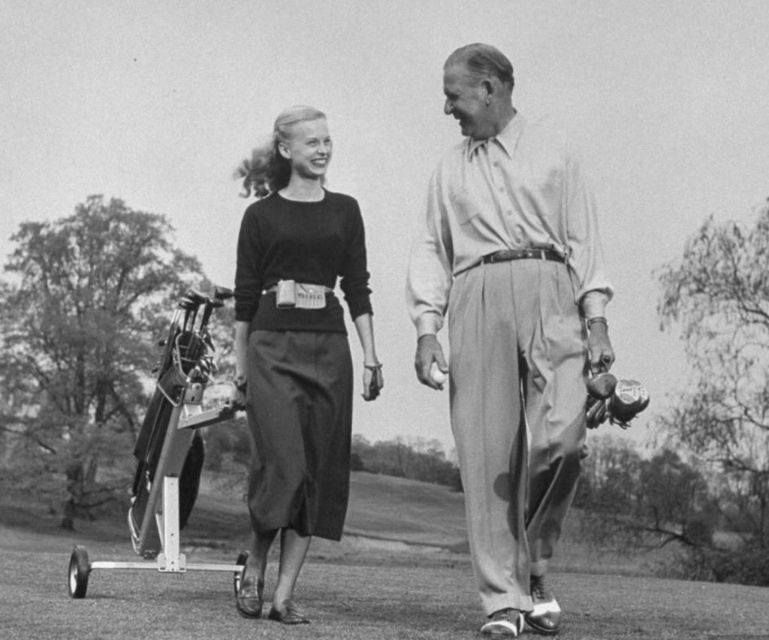
Can you confirm if light beige cotton pants at center is positioned above matte black sweater at center?

Yes, light beige cotton pants at center is above matte black sweater at center.

Can you confirm if light beige cotton pants at center is thinner than matte black sweater at center?

Correct, light beige cotton pants at center's width is less than matte black sweater at center's.

Does point (475, 404) lie behind point (298, 113)?

No.

Where is `light beige cotton pants at center`? This screenshot has height=640, width=769. light beige cotton pants at center is located at coordinates (508, 330).